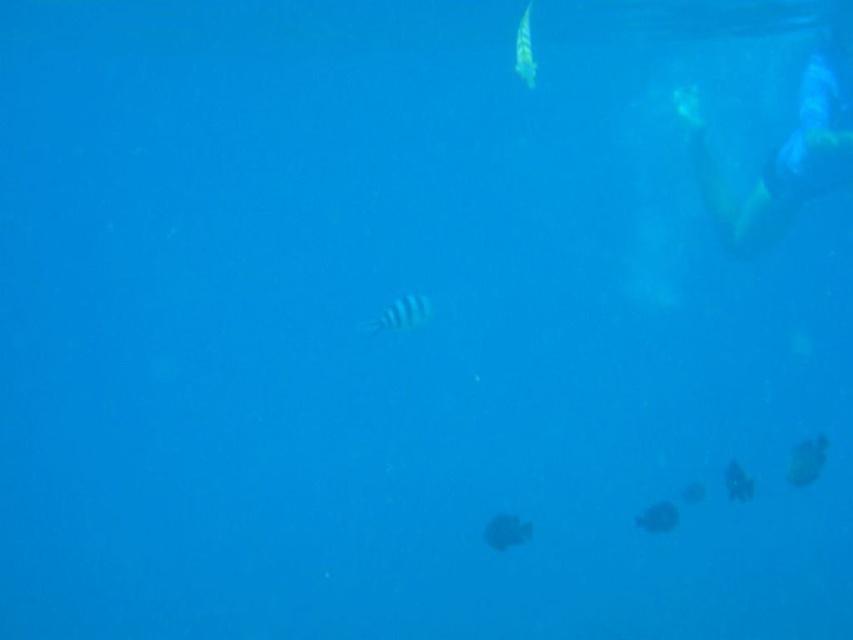
Question: Is smooth black fish at lower right above dark matte fish at lower right?

Choices:
 (A) yes
 (B) no

Answer: (A)

Question: Considering the real-world distances, which object is farthest from the yellow-green skin at upper right?

Choices:
 (A) blue striped fish at center
 (B) smooth gray fish at lower right
 (C) dark gray matte fish at center
 (D) dark matte fish at lower right

Answer: (C)

Question: Can you confirm if blue striped fish at center is bigger than dark matte fish at lower right?

Choices:
 (A) no
 (B) yes

Answer: (B)

Question: Which object appears closest to the camera in this image?

Choices:
 (A) dark gray matte fish at center
 (B) dark matte fish at lower right
 (C) smooth black fish at lower right
 (D) blue striped fish at center

Answer: (C)

Question: Does yellow-green skin at upper right appear on the left side of dark gray matte fish at center?

Choices:
 (A) yes
 (B) no

Answer: (B)

Question: Considering the real-world distances, which object is farthest from the blue striped fish at center?

Choices:
 (A) translucent greenish-blue fish at upper right
 (B) smooth gray fish at lower right
 (C) smooth black fish at lower right

Answer: (A)